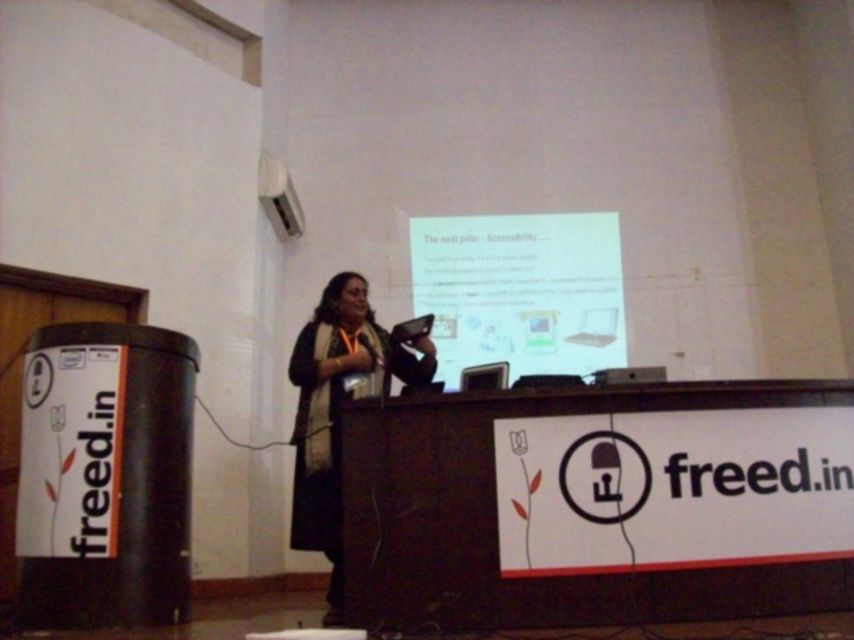
Question: Is white glossy projector screen at upper center behind black fabric at center?

Choices:
 (A) no
 (B) yes

Answer: (B)

Question: Which point is farther from the camera taking this photo?

Choices:
 (A) (370, 368)
 (B) (603, 243)

Answer: (B)

Question: Among these objects, which one is nearest to the camera?

Choices:
 (A) black fabric at center
 (B) white glossy projector screen at upper center

Answer: (A)

Question: Is white glossy projector screen at upper center wider than black fabric at center?

Choices:
 (A) yes
 (B) no

Answer: (A)

Question: Which object is closer to the camera taking this photo?

Choices:
 (A) black fabric at center
 (B) white glossy projector screen at upper center

Answer: (A)

Question: Can you confirm if white glossy projector screen at upper center is positioned to the right of black fabric at center?

Choices:
 (A) no
 (B) yes

Answer: (B)